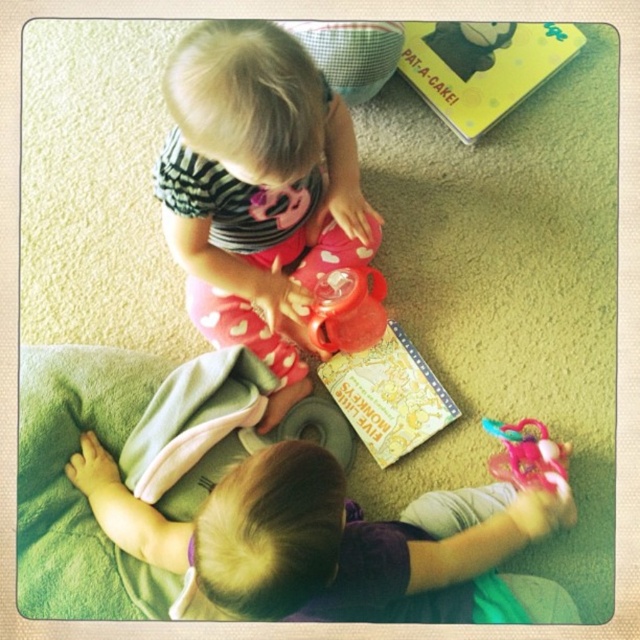
Can you confirm if brown fuzzy blanket at lower center is positioned to the right of yellow paper book at center?

Incorrect, brown fuzzy blanket at lower center is not on the right side of yellow paper book at center.

Is brown fuzzy blanket at lower center smaller than yellow paper book at center?

No.

Does point (509, 484) lie behind point (410, 442)?

No, (509, 484) is closer to viewer.

Where is `brown fuzzy blanket at lower center`? brown fuzzy blanket at lower center is located at coordinates (317, 534).

Image resolution: width=640 pixels, height=640 pixels. What do you see at coordinates (481, 67) in the screenshot?
I see `yellow matte book at upper right` at bounding box center [481, 67].

Which is below, yellow matte book at upper right or yellow paper book at center?

yellow paper book at center is below.

Where is `yellow matte book at upper right`? The width and height of the screenshot is (640, 640). yellow matte book at upper right is located at coordinates (481, 67).

Where is `yellow matte book at upper right`? This screenshot has width=640, height=640. yellow matte book at upper right is located at coordinates (481, 67).

Does point (205, 97) come in front of point (458, 81)?

That is True.

Can you confirm if pink fabric pants at center is positioned to the left of yellow matte book at upper right?

Yes, pink fabric pants at center is to the left of yellow matte book at upper right.

Is point (308, 220) positioned behind point (477, 92)?

That is False.

Find the location of a particular element. The image size is (640, 640). pink fabric pants at center is located at coordinates (259, 189).